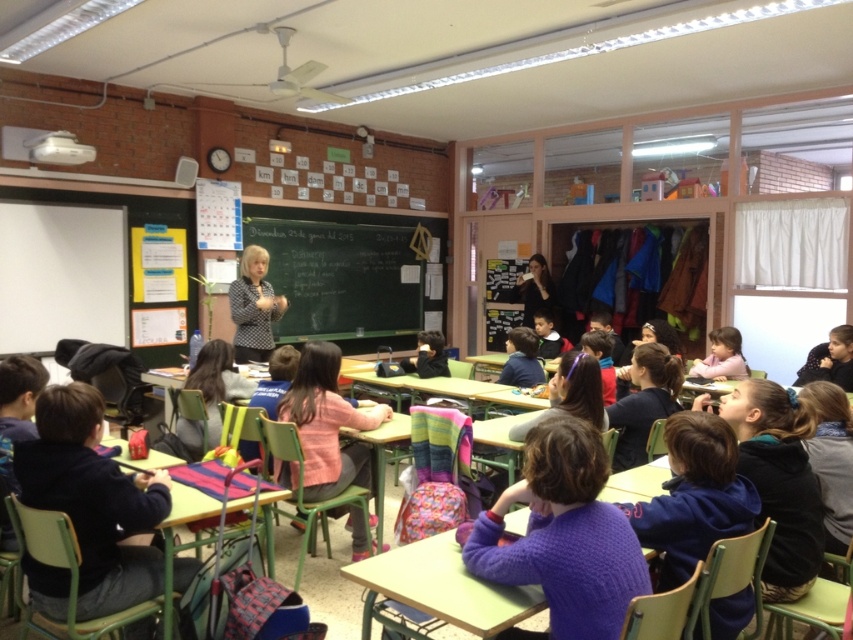
Can you confirm if blackboard at center is positioned to the left of matte black shirt at center?

Correct, you'll find blackboard at center to the left of matte black shirt at center.

Can you confirm if blackboard at center is positioned above matte black shirt at center?

Yes.

Find the location of a particular element. The image size is (853, 640). blackboard at center is located at coordinates (345, 269).

Find the location of a particular element. This screenshot has width=853, height=640. blackboard at center is located at coordinates (345, 269).

Measure the distance from pink fabric backpack at center to matte black shirt at center.

They are 13.27 feet apart.

Locate an element on the screen. pink fabric backpack at center is located at coordinates (328, 422).

Locate an element on the screen. Image resolution: width=853 pixels, height=640 pixels. pink fabric backpack at center is located at coordinates (328, 422).

Is dark blue sweater at center taller than purple fleece jacket at lower right?

Yes, dark blue sweater at center is taller than purple fleece jacket at lower right.

Does dark blue sweater at center have a greater width compared to purple fleece jacket at lower right?

Yes.

Is point (91, 554) behind point (709, 440)?

Yes, it is.

You are a GUI agent. You are given a task and a screenshot of the screen. Output one action in this format:
    pyautogui.click(x=<x>, y=<y>)
    Task: Click on the dark blue sweater at center
    
    Given the screenshot: What is the action you would take?
    pyautogui.click(x=93, y=499)